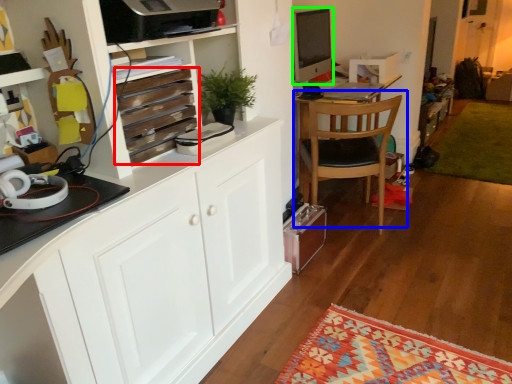
Question: Which object is the closest to the drawer (highlighted by a red box)? Choose among these: chair (highlighted by a blue box) or desktop computer (highlighted by a green box).

Choices:
 (A) chair
 (B) desktop computer

Answer: (B)